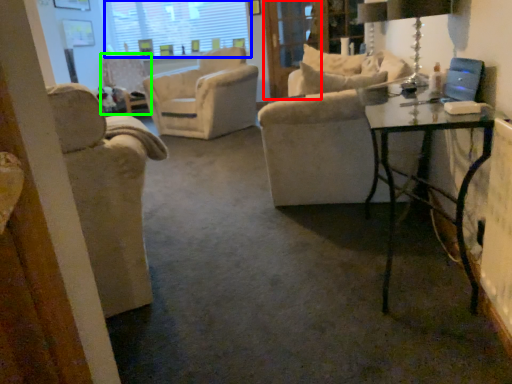
Question: Considering the real-world distances, which object is farthest from screen door (highlighted by a red box)? window screen (highlighted by a blue box) or chair (highlighted by a green box)?

Choices:
 (A) window screen
 (B) chair

Answer: (A)